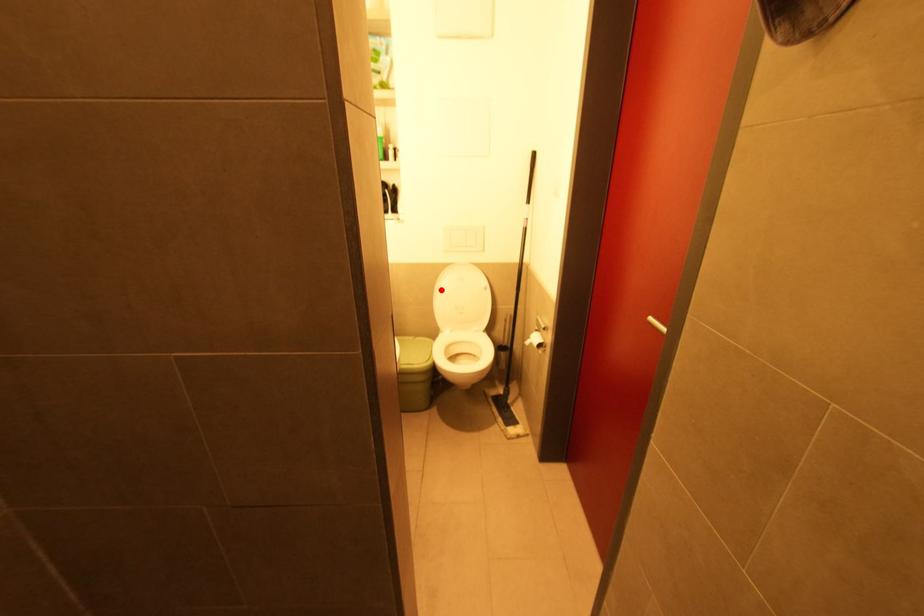
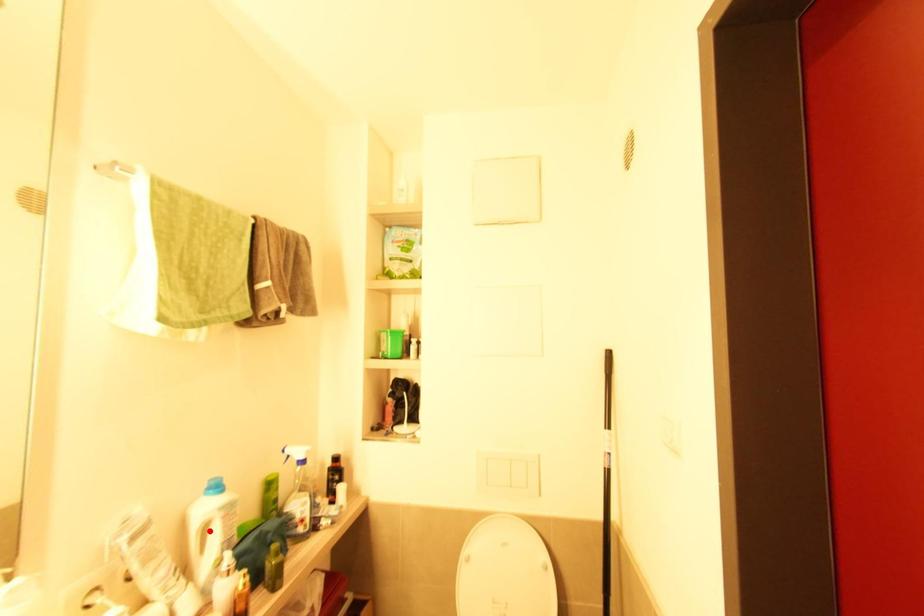
I am providing you with two images of the same scene from different viewpoints. A red point is marked on the first image and another point is marked on the second image. Are the points marked in image1 and image2 representing the same 3D position?

No